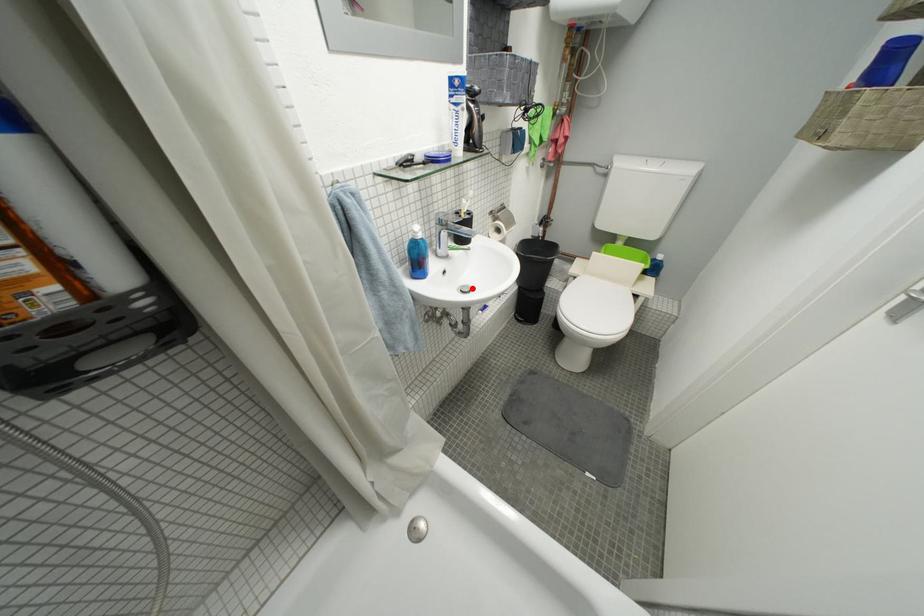
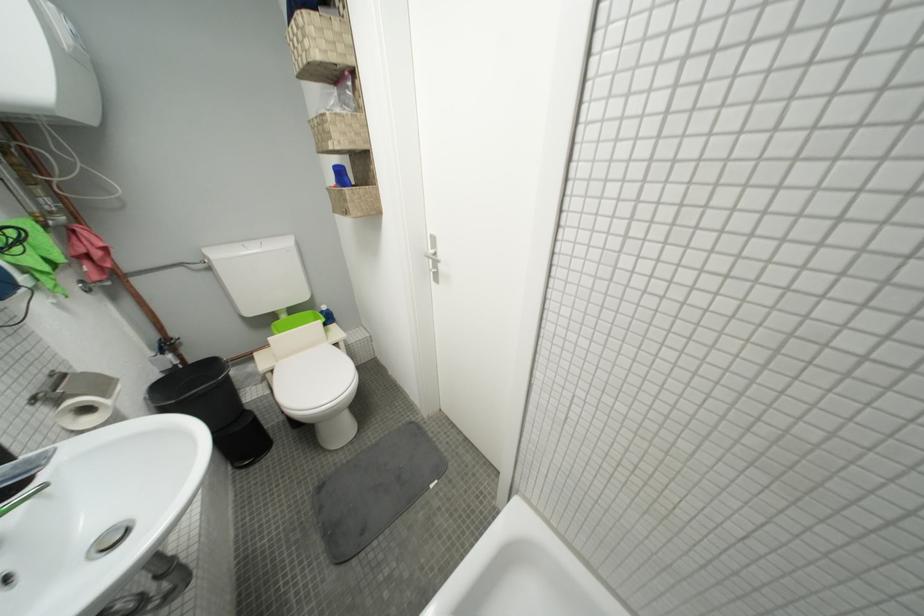
Find the pixel in the second image that matches the highlighted location in the first image.

(107, 541)